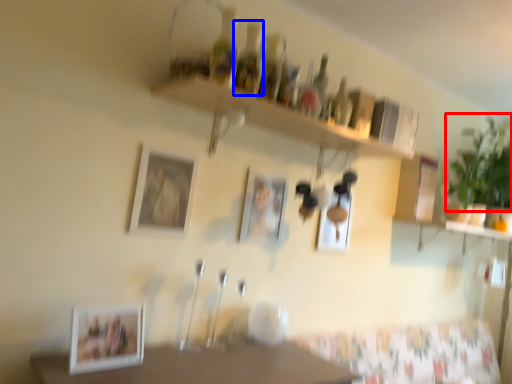
Question: Which point is closer to the camera, plant (highlighted by a red box) or bottle (highlighted by a blue box)?

Choices:
 (A) plant
 (B) bottle

Answer: (B)